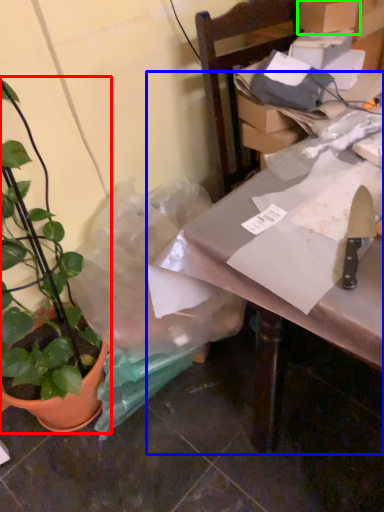
Question: Estimate the real-world distances between objects in this image. Which object is closer to houseplant (highlighted by a red box), table (highlighted by a blue box) or cardboard box (highlighted by a green box)?

Choices:
 (A) table
 (B) cardboard box

Answer: (A)